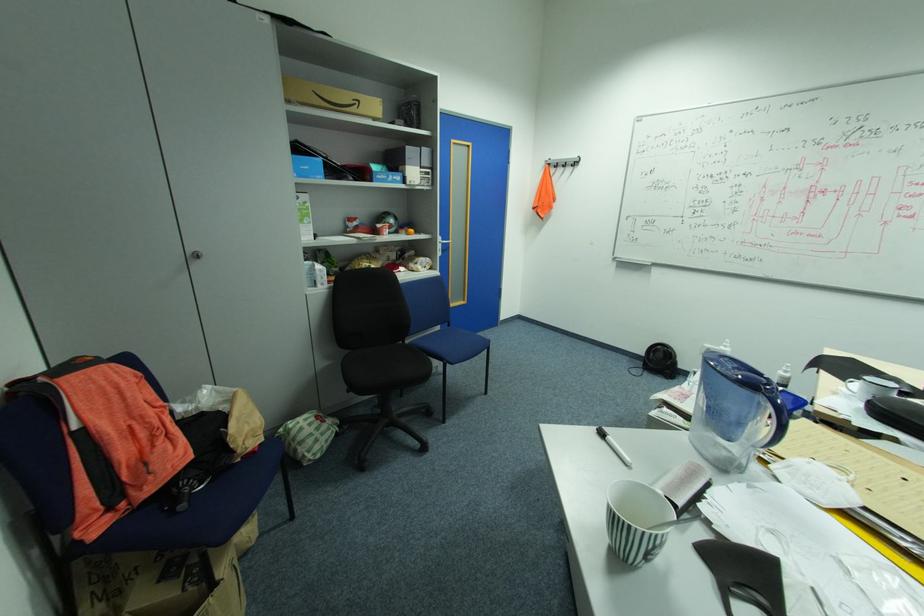
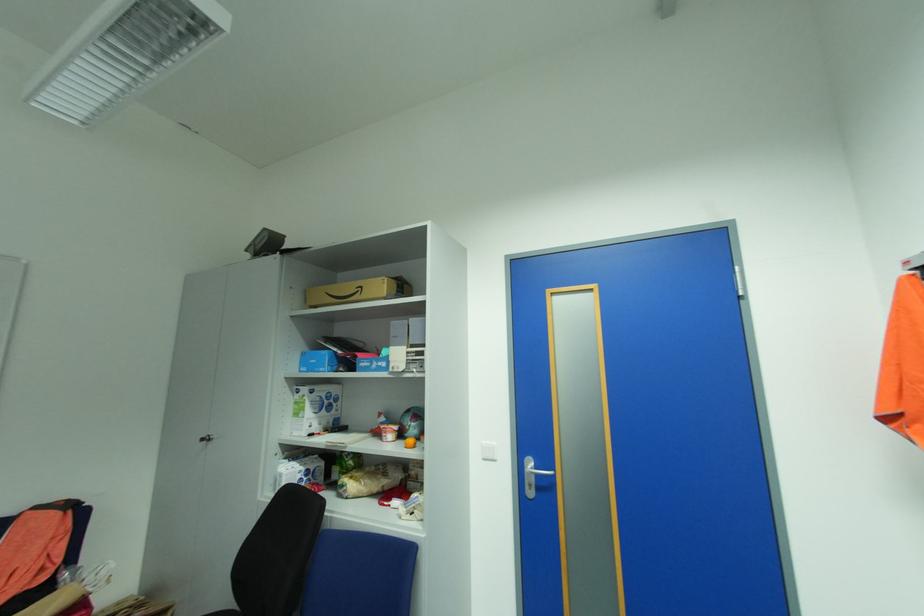
The point at (366, 100) is marked in the first image. Where is the corresponding point in the second image?

(368, 286)